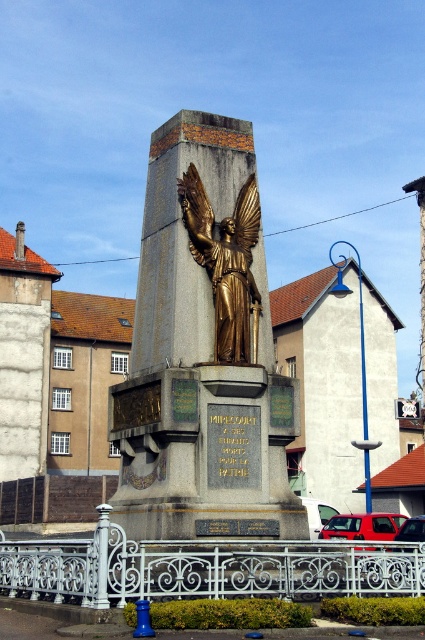
You are standing in front of the monument in the town square. You notice two points marked on the monument. The first point is at coordinates point (x=166, y=461) and the second is at point (x=215, y=269). If you were to touch both points with your finger, which point would require your hand to move closer to the monument?

Point (x=166, y=461) is closer to the camera than point (x=215, y=269), so touching point (x=166, y=461) would require your hand to move closer to the monument.